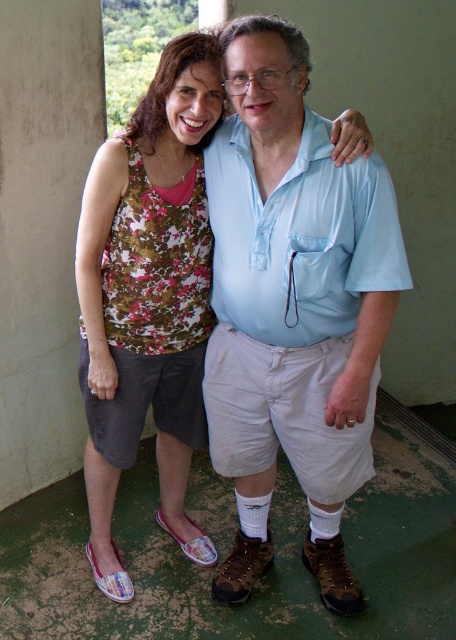
Between light blue cotton shirt at center and floral fabric tank top at center, which one has less height?

floral fabric tank top at center

Can you confirm if light blue cotton shirt at center is positioned to the left of floral fabric tank top at center?

In fact, light blue cotton shirt at center is to the right of floral fabric tank top at center.

At what (x,y) coordinates should I click in order to perform the action: click on light blue cotton shirt at center. Please return your answer as a coordinate pair (x, y). Image resolution: width=456 pixels, height=640 pixels. Looking at the image, I should click on (293, 307).